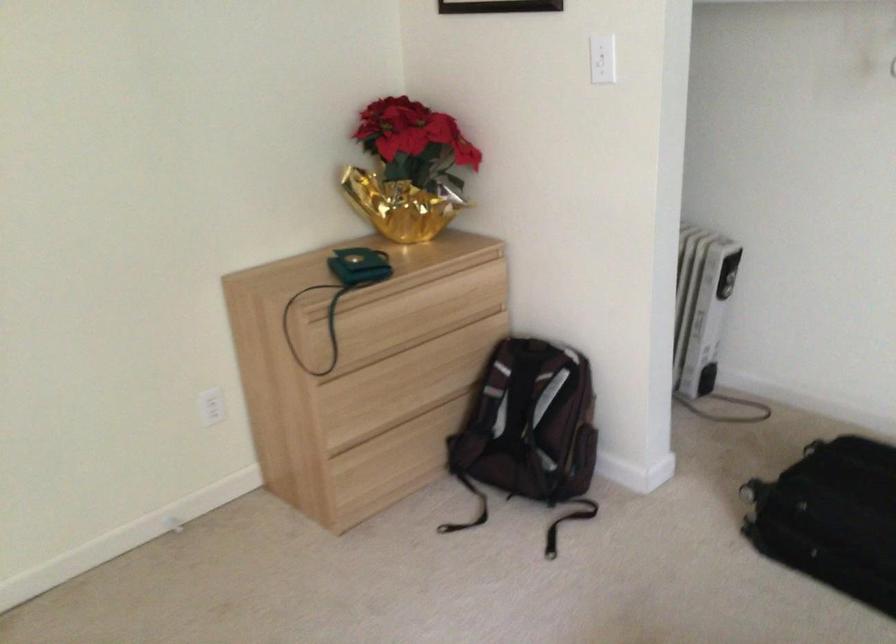
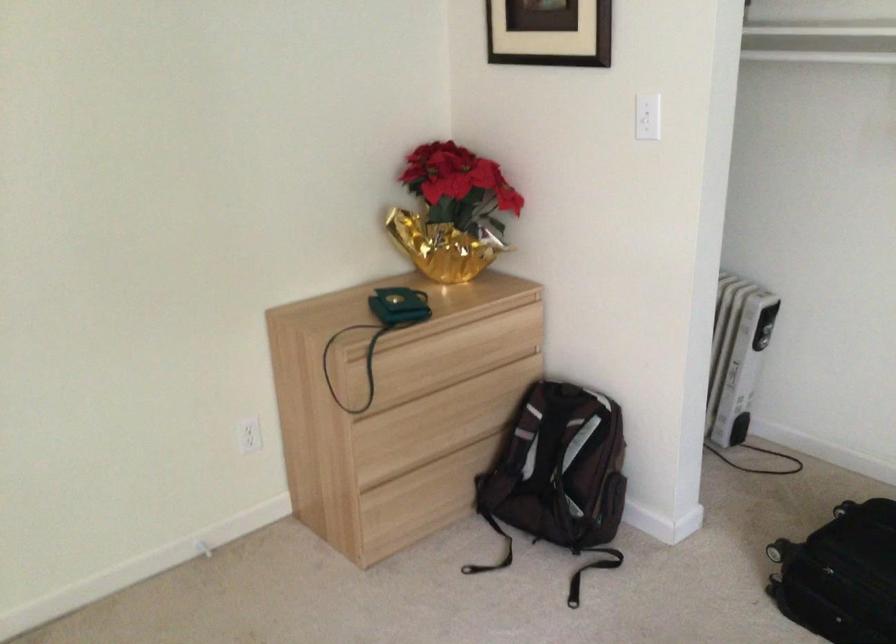
In the second image, find the point that corresponds to (418,314) in the first image.

(454, 355)